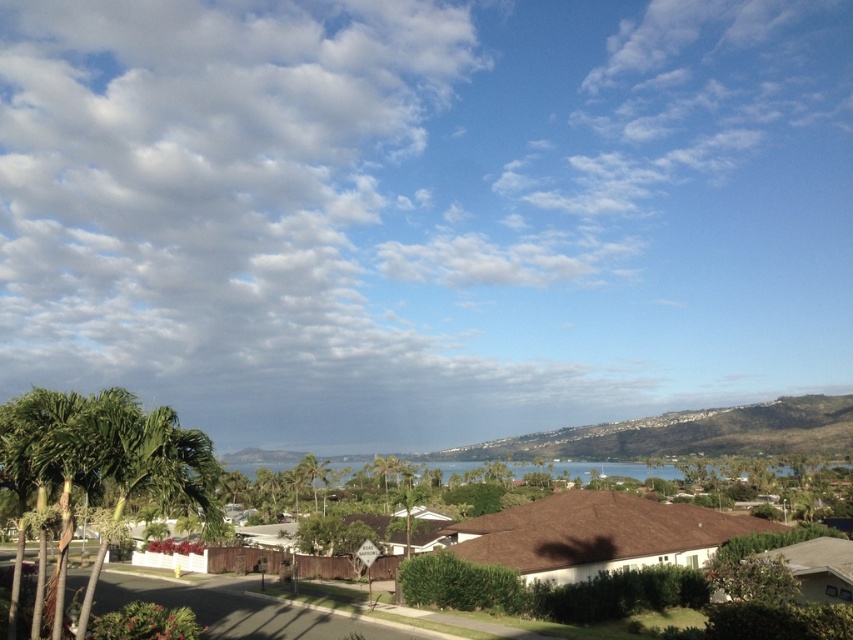
Question: Is green leafy palm tree at lower left to the left of green leafy palm tree at center from the viewer's perspective?

Choices:
 (A) no
 (B) yes

Answer: (A)

Question: Can you confirm if white fluffy cloud at upper center is wider than green leafy palm tree at center?

Choices:
 (A) yes
 (B) no

Answer: (A)

Question: Does white fluffy cloud at upper center come in front of green leafy palm tree at lower left?

Choices:
 (A) yes
 (B) no

Answer: (B)

Question: Which point appears farthest from the camera in this image?

Choices:
 (A) (64, 472)
 (B) (434, 362)

Answer: (B)

Question: Which is nearer to the white fluffy cloud at upper center?

Choices:
 (A) green leafy palm tree at lower left
 (B) green leafy palm tree at center

Answer: (B)

Question: Among these objects, which one is farthest from the camera?

Choices:
 (A) white fluffy cloud at upper center
 (B) green leafy palm tree at center
 (C) green leafy palm tree at lower left

Answer: (A)